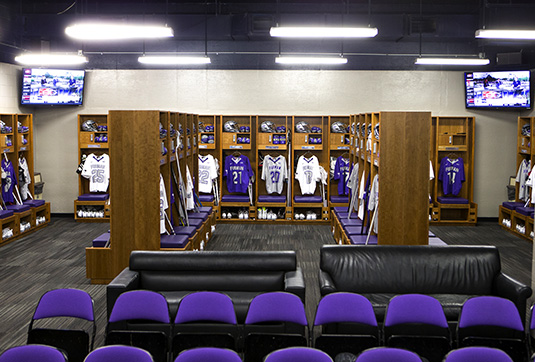
Image resolution: width=535 pixels, height=362 pixels. Find the location of `closets`. closets is located at coordinates (137, 182), (14, 150), (408, 189), (471, 161).